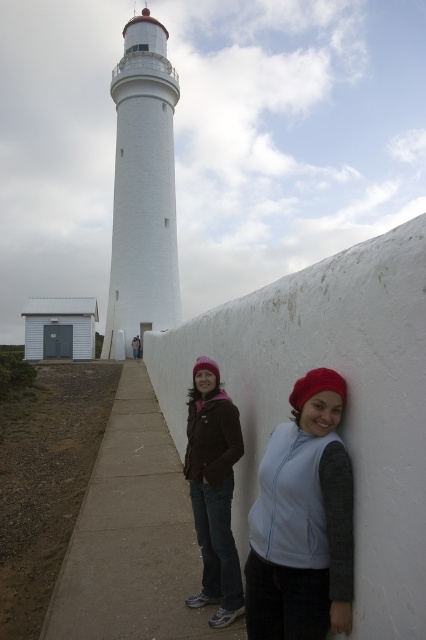
Measure the distance from light blue fleece vest at center to white painted concrete lighthouse at left.

light blue fleece vest at center and white painted concrete lighthouse at left are 33.42 meters apart.

Can you confirm if light blue fleece vest at center is positioned below white painted concrete lighthouse at left?

Indeed, light blue fleece vest at center is positioned under white painted concrete lighthouse at left.

Between point (255, 563) and point (161, 252), which one is positioned in front?

Point (255, 563) is in front.

I want to click on light blue fleece vest at center, so click(x=302, y=522).

Who is taller, light blue fleece vest at center or matte brown jacket at center?

Standing taller between the two is matte brown jacket at center.

Can you confirm if light blue fleece vest at center is taller than matte brown jacket at center?

No, light blue fleece vest at center is not taller than matte brown jacket at center.

At what (x,y) coordinates should I click in order to perform the action: click on light blue fleece vest at center. Please return your answer as a coordinate pair (x, y). This screenshot has height=640, width=426. Looking at the image, I should click on (302, 522).

Image resolution: width=426 pixels, height=640 pixels. I want to click on light blue fleece vest at center, so click(x=302, y=522).

Does white painted concrete lighthouse at left have a lesser height compared to matte brown jacket at center?

No, white painted concrete lighthouse at left is not shorter than matte brown jacket at center.

Is point (166, 236) behind point (209, 358)?

Yes, it is behind point (209, 358).

I want to click on white painted concrete lighthouse at left, so click(143, 188).